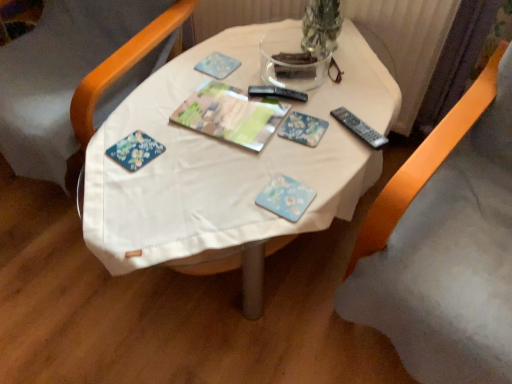
Find the location of a particular element. free location in front of floral paper magazine at center is located at coordinates (224, 175).